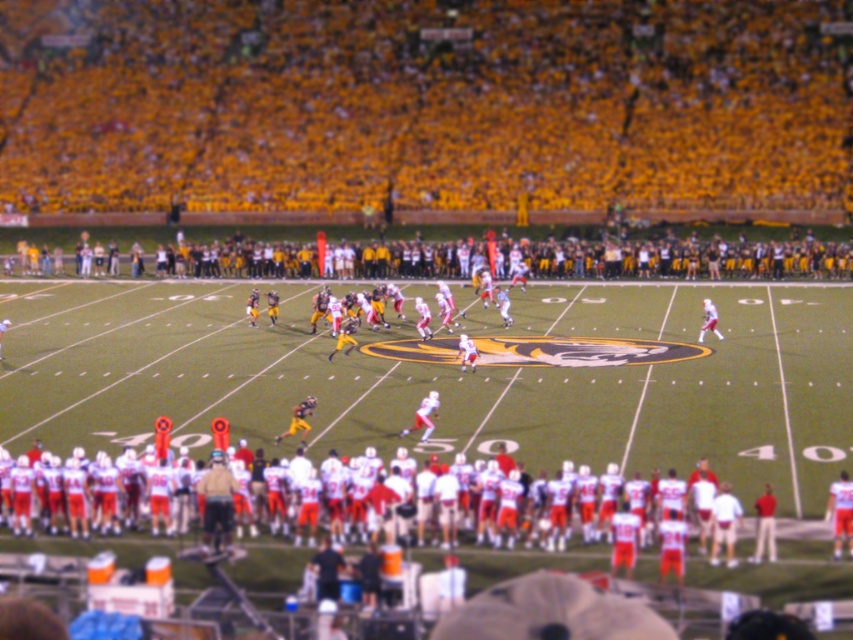
Between point (651, 106) and point (537, 404), which one is positioned behind?

Point (651, 106)

Based on the photo, can you confirm if yellow fabric seats at upper center is positioned to the right of white fabric football team at lower center?

Incorrect, yellow fabric seats at upper center is not on the right side of white fabric football team at lower center.

You are a GUI agent. You are given a task and a screenshot of the screen. Output one action in this format:
    pyautogui.click(x=<x>, y=<y>)
    Task: Click on the yellow fabric seats at upper center
    
    Given the screenshot: What is the action you would take?
    [424, 104]